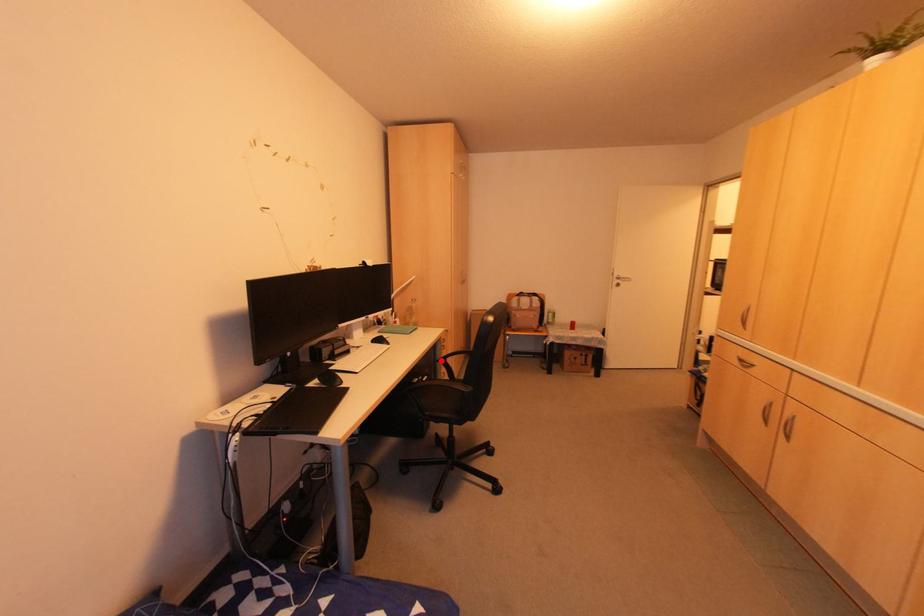
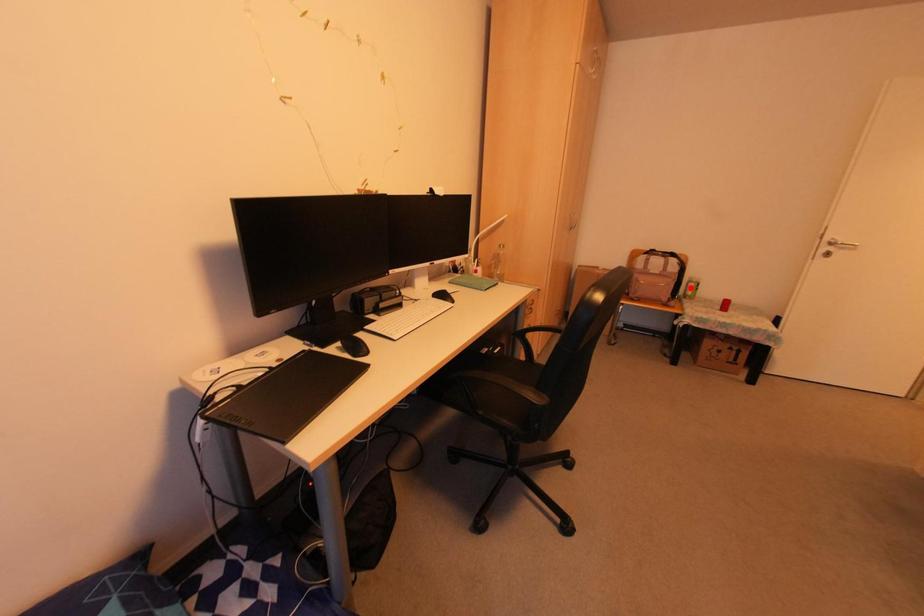
I am providing you with two images of the same scene from different viewpoints. A red point is marked on the first image and another point is marked on the second image. Is the red point in image1 aligned with the point shown in image2?

No